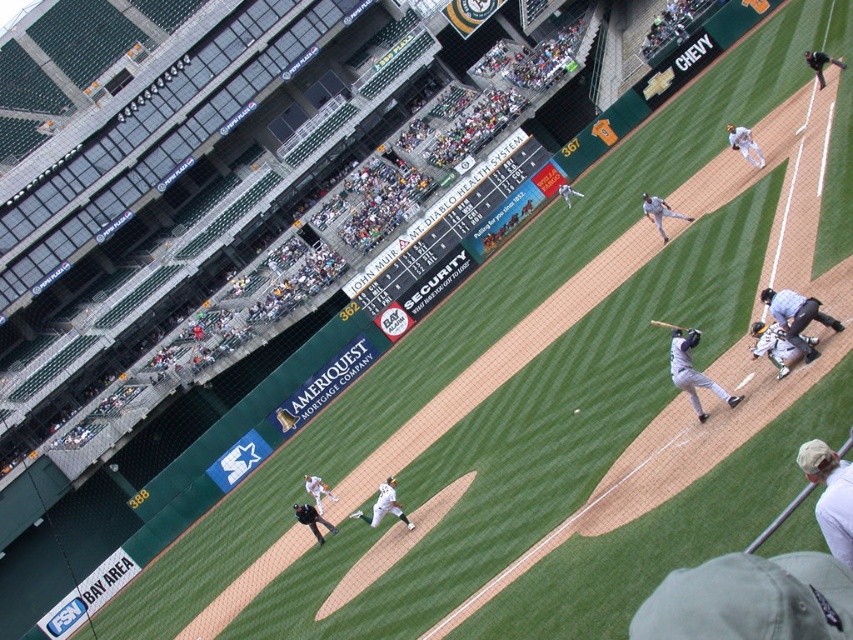
Does dark brown leather glove at lower right have a larger size compared to wooden baseball bat at right?

Incorrect, dark brown leather glove at lower right is not larger than wooden baseball bat at right.

Who is more distant from viewer, (759, 321) or (670, 326)?

Positioned behind is point (670, 326).

Where is `dark brown leather glove at lower right`? This screenshot has width=853, height=640. dark brown leather glove at lower right is located at coordinates (757, 328).

Locate an element on the screen. Image resolution: width=853 pixels, height=640 pixels. white cloth cap at lower right is located at coordinates (830, 496).

Is white uniform pitcher at center thinner than white uniform at center?

Correct, white uniform pitcher at center's width is less than white uniform at center's.

Does point (376, 497) lie behind point (323, 490)?

Yes, it is.

Is point (376, 508) farther from viewer compared to point (321, 496)?

No.

Identify the location of white uniform pitcher at center. This screenshot has height=640, width=853. (384, 506).